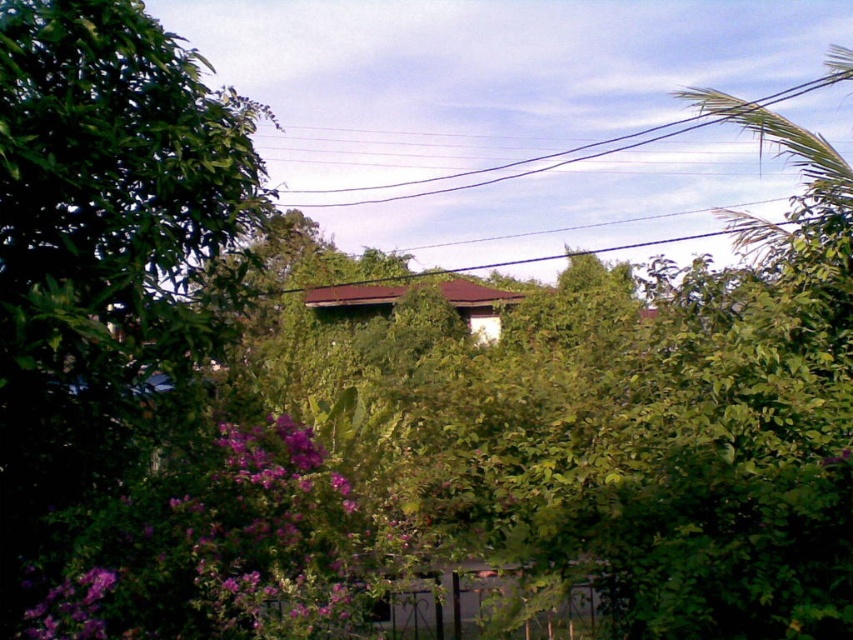
In the scene shown: Which of these two, black wire at upper center or purple matte flower at lower left, stands shorter?

purple matte flower at lower left is shorter.

I want to click on black wire at upper center, so click(569, 150).

At what (x,y) coordinates should I click in order to perform the action: click on black wire at upper center. Please return your answer as a coordinate pair (x, y). Looking at the image, I should click on (569, 150).